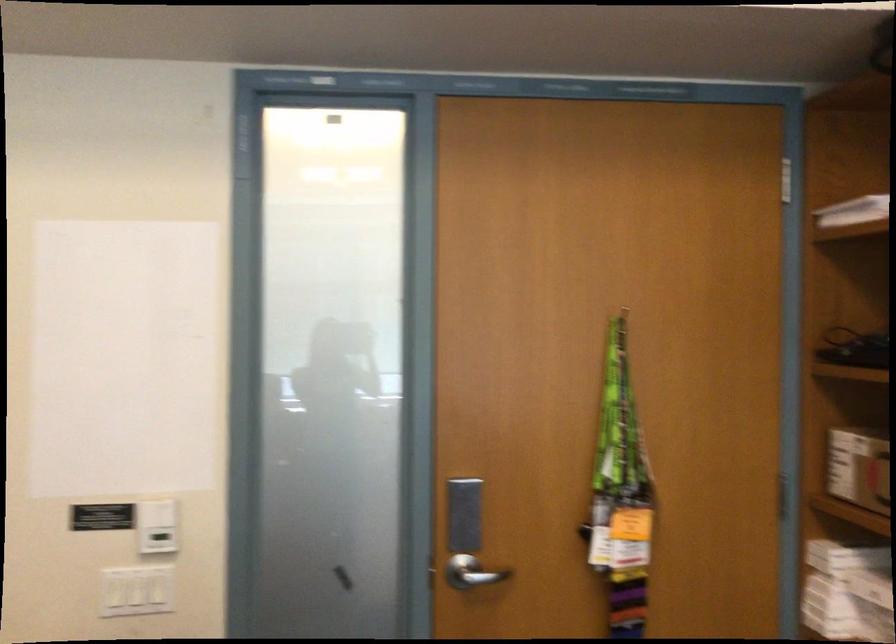
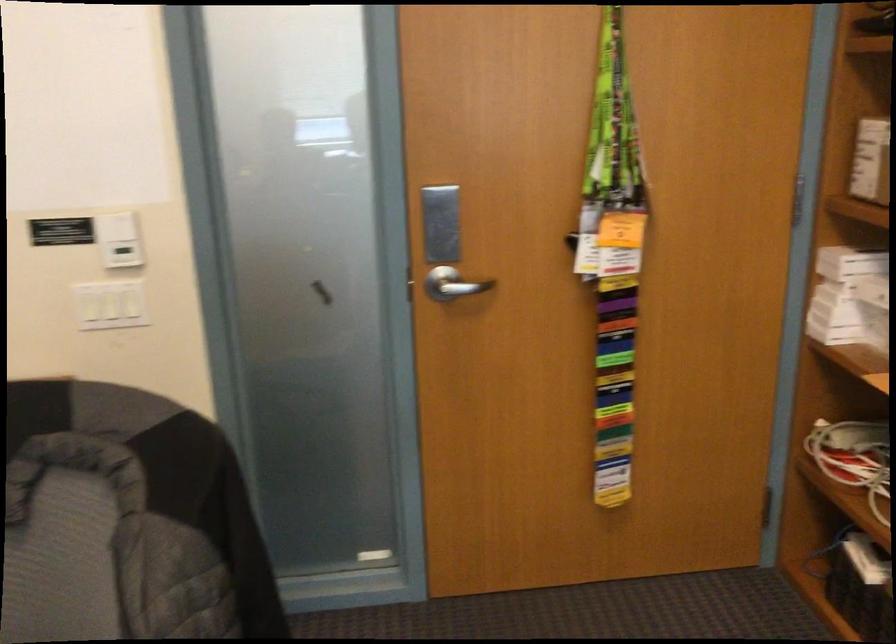
Locate, in the second image, the point that corresponds to (x=625, y=553) in the first image.

(613, 259)